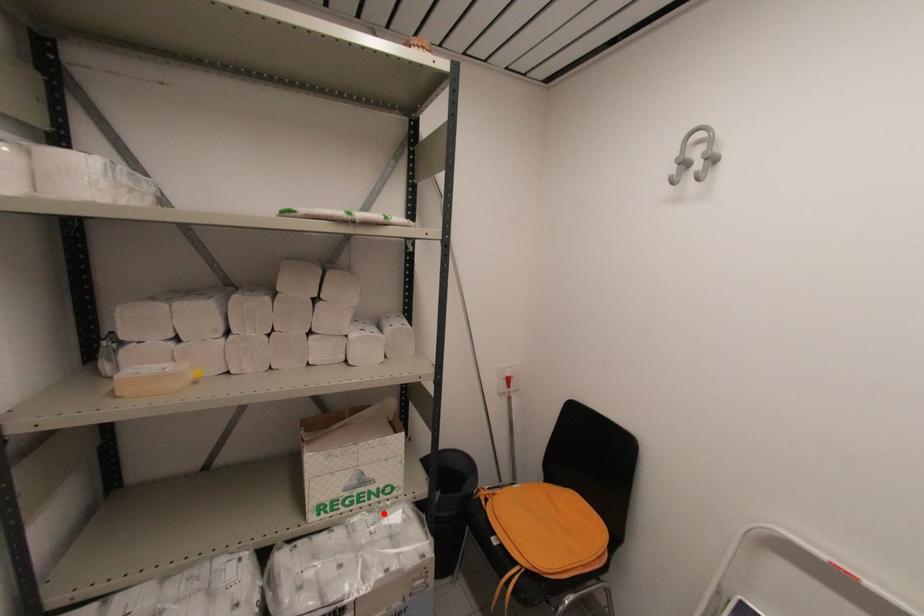
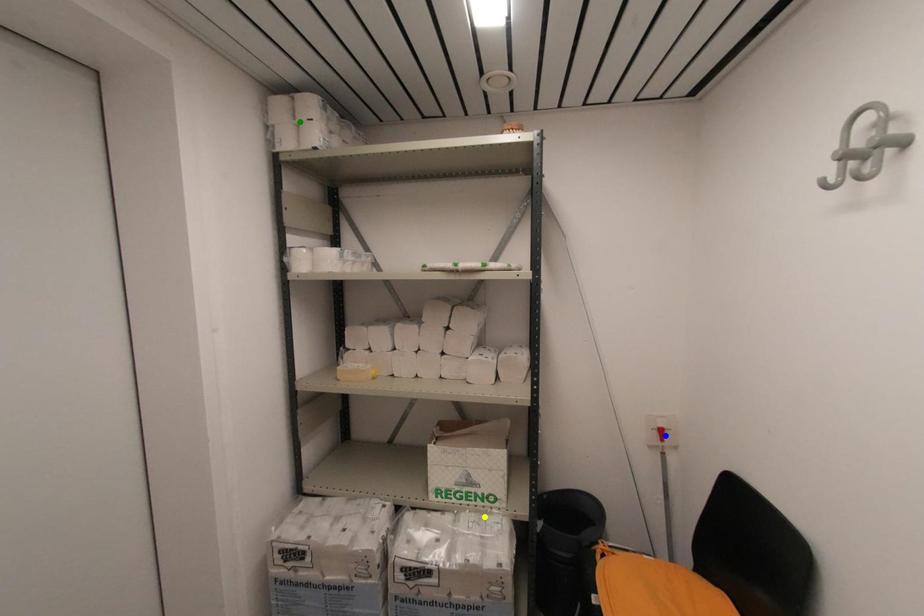
Question: I am providing you with two images of the same scene from different viewpoints. A red point is marked on the first image. You are given multiple points on the second image. In image 2, which mark is for the same physical point as the one in image 1?

Choices:
 (A) blue point
 (B) green point
 (C) yellow point

Answer: (C)